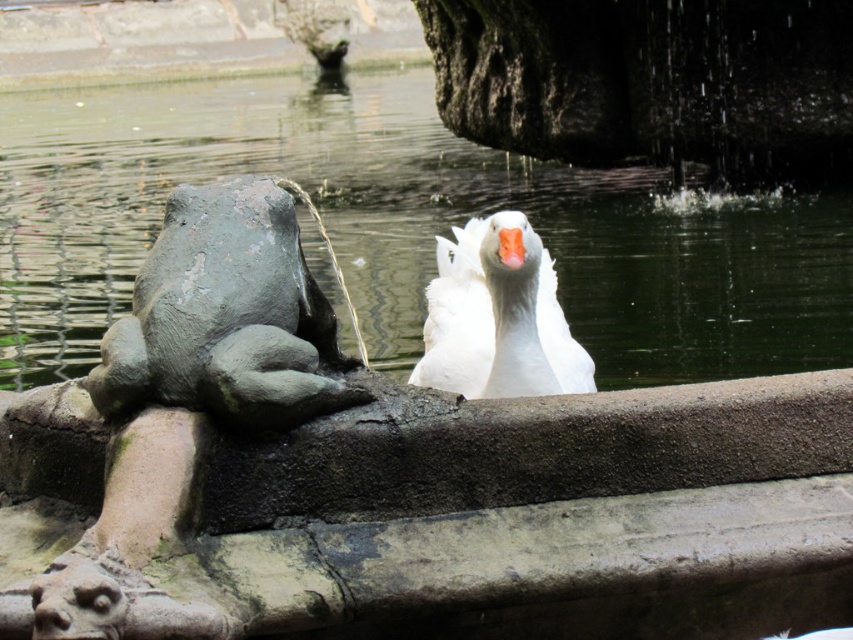
Who is lower down, clear water at frog left or white matte duck at center?

white matte duck at center

Which is more to the right, clear water at frog left or white matte duck at center?

white matte duck at center

Which is behind, point (178, 92) or point (535, 240)?

Point (178, 92)

Find the location of a particular element. clear water at frog left is located at coordinates (407, 227).